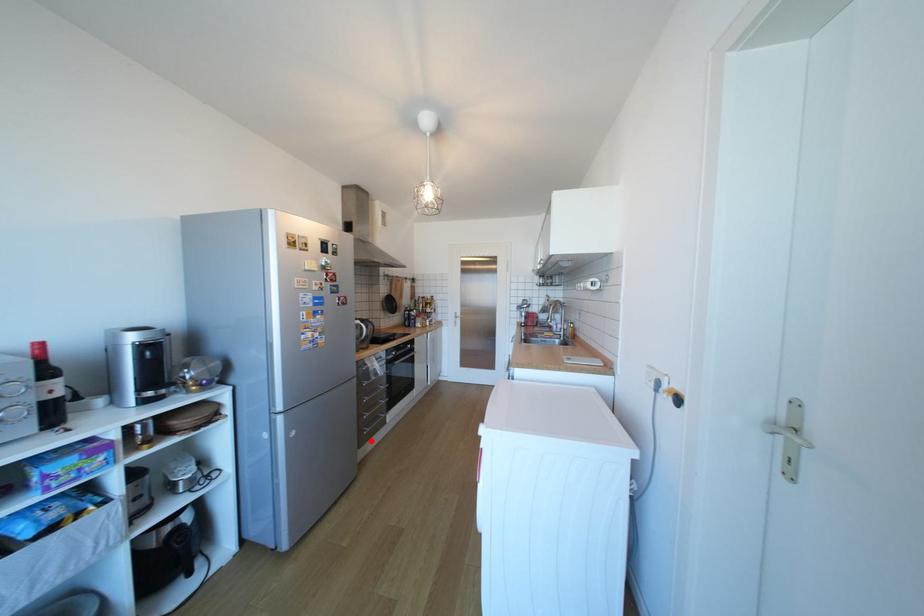
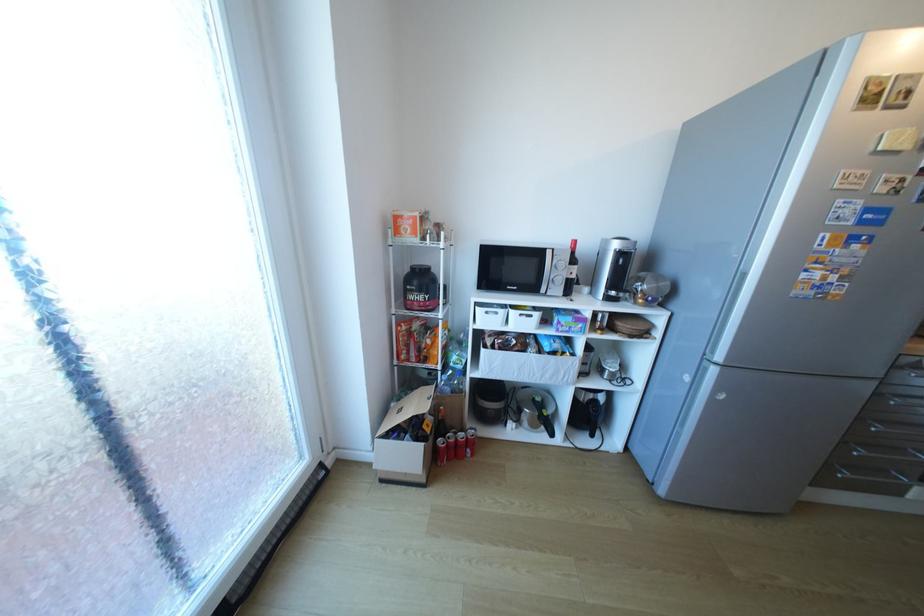
Question: I am providing you with two images of the same scene from different viewpoints. A red point is marked on the first image. Can you still see the location of the red point in image 2?

Choices:
 (A) Yes
 (B) No

Answer: (A)